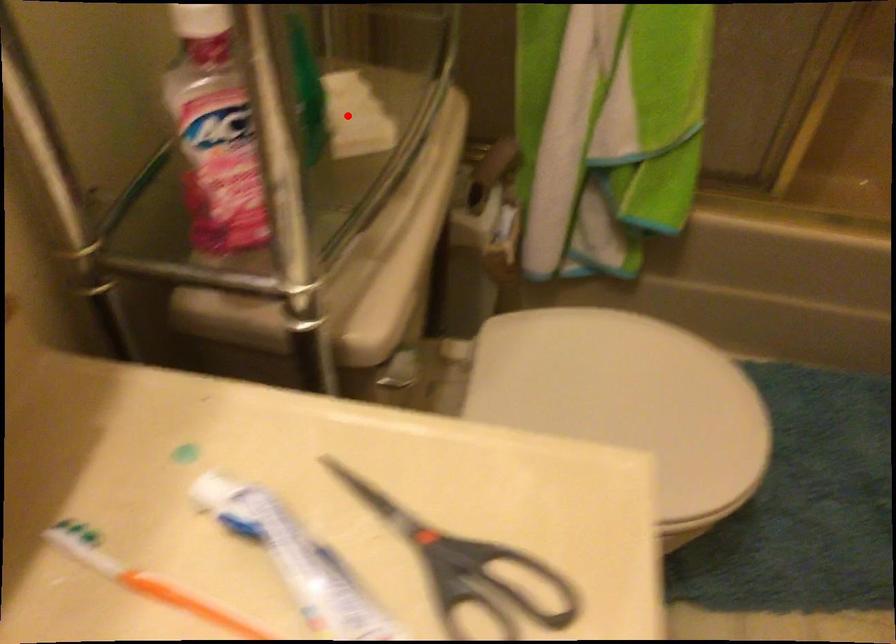
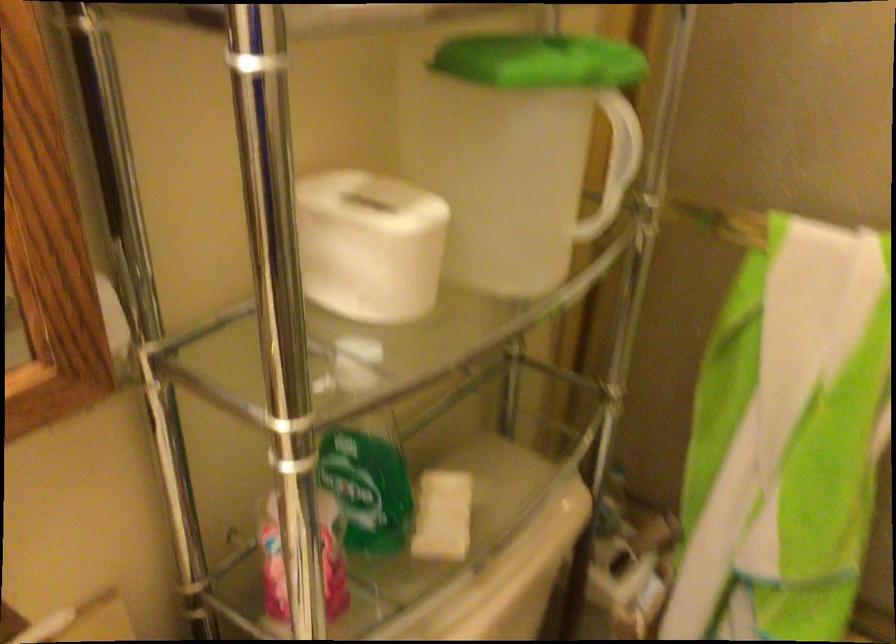
Question: A red point is marked in image1. In image2, is the corresponding 3D point closer to the camera or farther? Reply with the corresponding letter.

Choices:
 (A) The corresponding 3D point is closer.
 (B) The corresponding 3D point is farther.

Answer: (B)